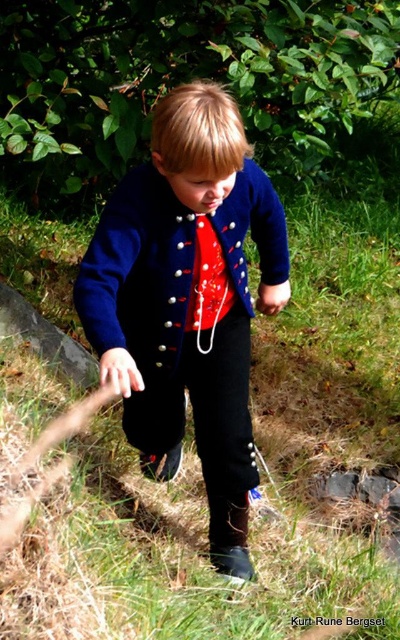
Does green grass at center appear over navy woolen jacket at center?

Yes.

Between point (20, 253) and point (241, 273), which one is positioned behind?

The point (20, 253) is more distant.

This screenshot has height=640, width=400. I want to click on green grass at center, so click(x=299, y=445).

Who is taller, navy woolen jacket at center or shiny red fabric tie at center?

Standing taller between the two is navy woolen jacket at center.

Does point (164, 241) come in front of point (192, 273)?

Yes.

What do you see at coordinates (188, 300) in the screenshot? I see `navy woolen jacket at center` at bounding box center [188, 300].

Find the location of `navy woolen jacket at center`. navy woolen jacket at center is located at coordinates (188, 300).

Who is shorter, green grass at center or navy wool jacket at center?

navy wool jacket at center is shorter.

Does point (268, 324) lie behind point (115, 236)?

That is True.

Who is more distant from viewer, (318, 312) or (172, 189)?

Positioned behind is point (318, 312).

This screenshot has height=640, width=400. In order to click on green grass at center in this screenshot , I will do `click(299, 445)`.